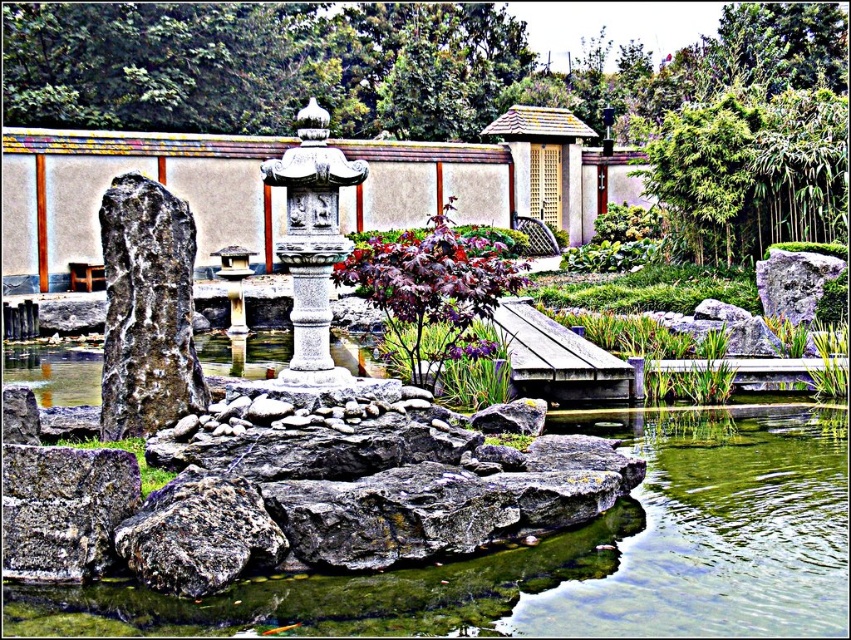
Is greenish water at center closer to camera compared to purple matte/leathery leaf at center?

Yes, it is.

Is point (620, 605) behind point (444, 228)?

No.

Locate an element on the screen. The image size is (851, 640). greenish water at center is located at coordinates [574, 554].

Does rusty metallic rock at lower left come behind gray rough rock at right?

No, it is in front of gray rough rock at right.

Is point (55, 506) positioned before point (795, 253)?

Yes, point (55, 506) is in front of point (795, 253).

Where is `rusty metallic rock at lower left`? The width and height of the screenshot is (851, 640). rusty metallic rock at lower left is located at coordinates (63, 509).

Locate an element on the screen. The width and height of the screenshot is (851, 640). rusty metallic rock at lower left is located at coordinates (63, 509).

How much distance is there between purple matte/leathery leaf at center and rusty metallic rock at lower left?

6.49 meters

Can you confirm if purple matte/leathery leaf at center is smaller than rusty metallic rock at lower left?

No, purple matte/leathery leaf at center is not smaller than rusty metallic rock at lower left.

Identify the location of purple matte/leathery leaf at center. (433, 284).